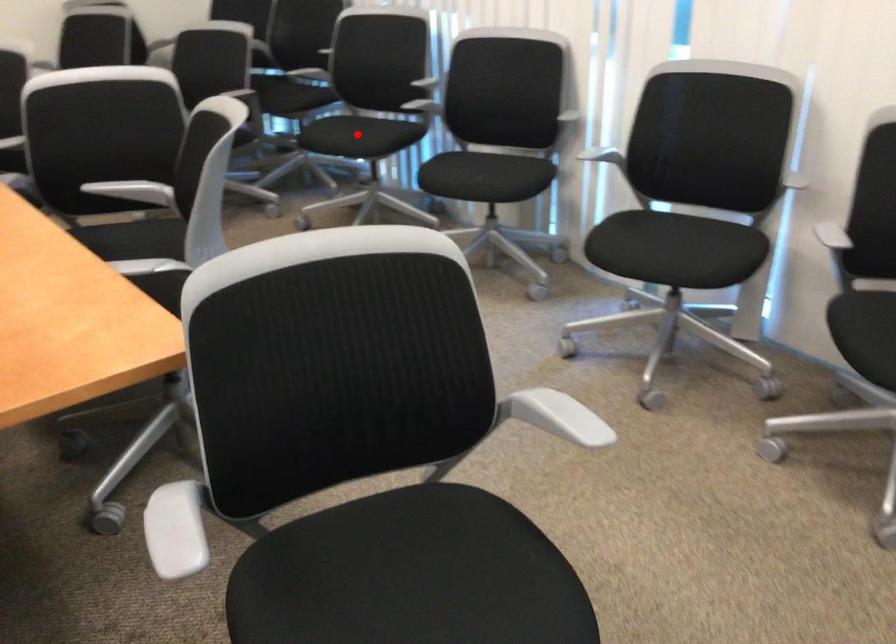
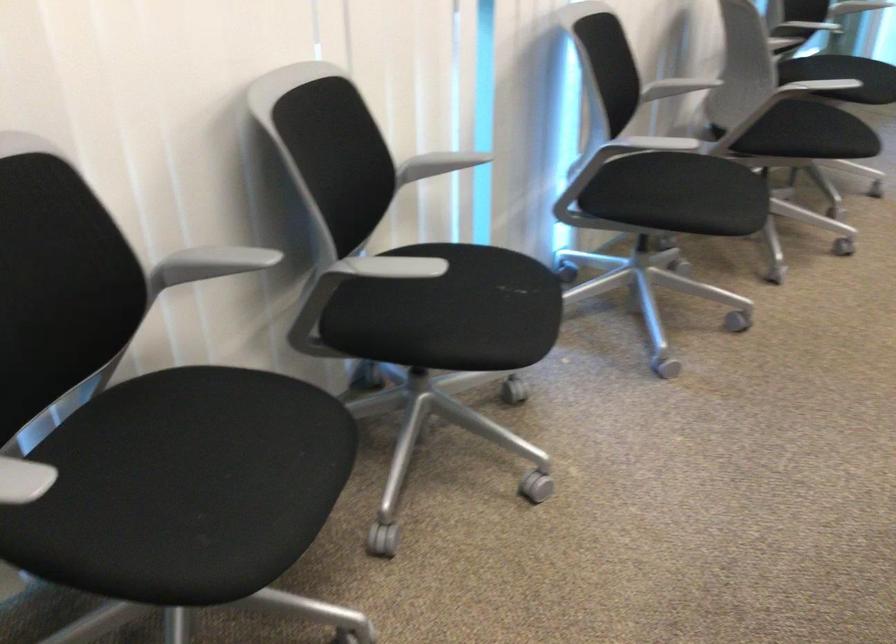
Question: I am providing you with two images of the same scene from different viewpoints. In image1, a red point is highlighted. Considering the same 3D point in image2, which of the following is correct?

Choices:
 (A) It is closer
 (B) It is farther

Answer: (A)